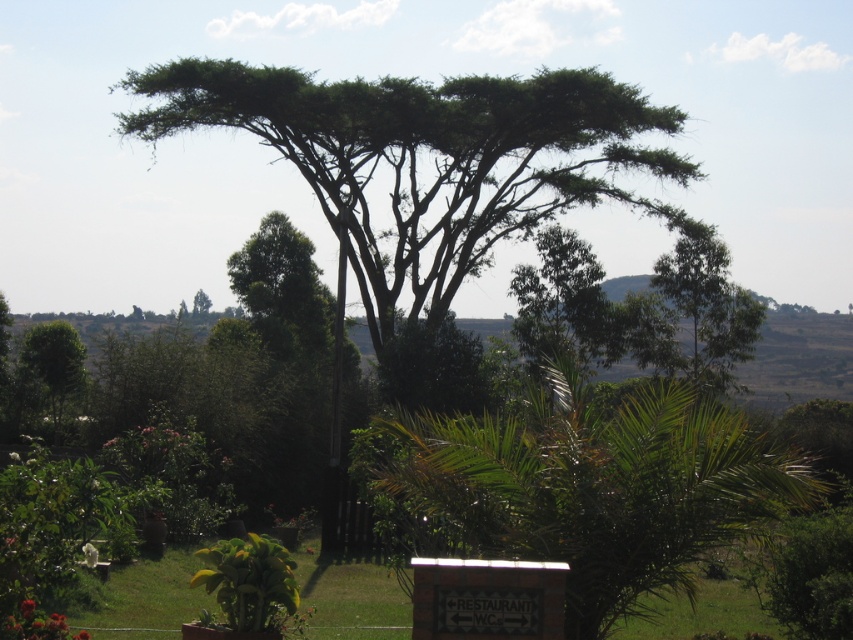
Question: Can you confirm if green leafy tree at left is smaller than green leafy tree at upper center?

Choices:
 (A) no
 (B) yes

Answer: (B)

Question: Which of these objects is positioned closest to the green leafy tree at upper center?

Choices:
 (A) green leafy tree at center
 (B) green leafy palm at center
 (C) green leafy tree at left

Answer: (A)

Question: Which point is farther from the camera taking this photo?

Choices:
 (A) (38, 364)
 (B) (198, 298)
 (C) (386, 88)
 (D) (723, 483)

Answer: (B)

Question: Is green leafy tree at center above green leafy tree at upper center?

Choices:
 (A) no
 (B) yes

Answer: (B)

Question: Considering the relative positions of green leafy palm at center and green leafy tree at left in the image provided, where is green leafy palm at center located with respect to green leafy tree at left?

Choices:
 (A) above
 (B) below

Answer: (B)

Question: Based on their relative distances, which object is farther from the green leafy tree at left?

Choices:
 (A) green leafy tree at center
 (B) green leafy palm at center

Answer: (A)